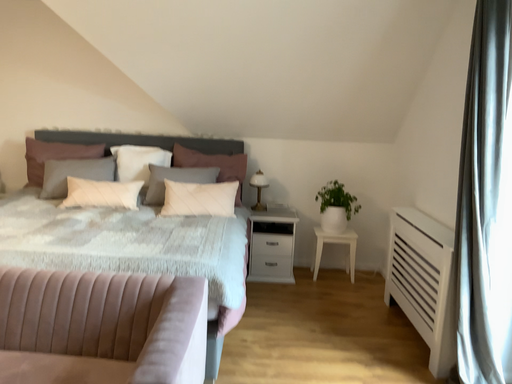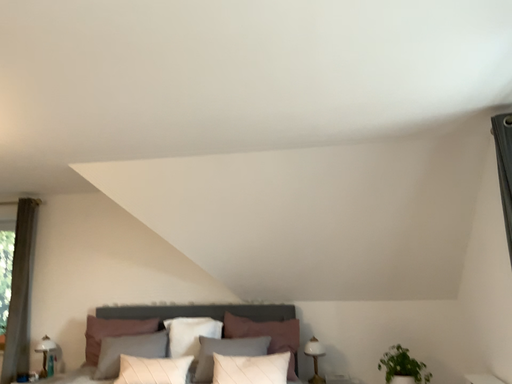
Question: How did the camera likely rotate when shooting the video?

Choices:
 (A) rotated right
 (B) rotated left

Answer: (B)